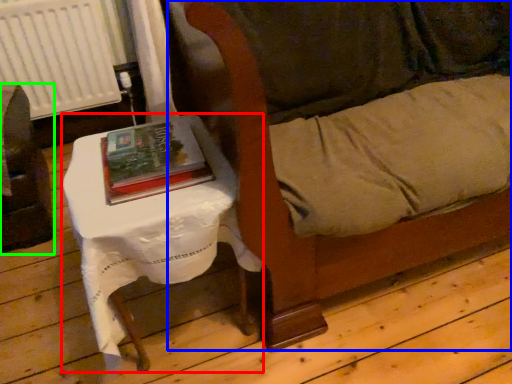
Question: Estimate the real-world distances between objects in this image. Which object is closer to table (highlighted by a red box), couch (highlighted by a blue box) or furniture (highlighted by a green box)?

Choices:
 (A) couch
 (B) furniture

Answer: (A)